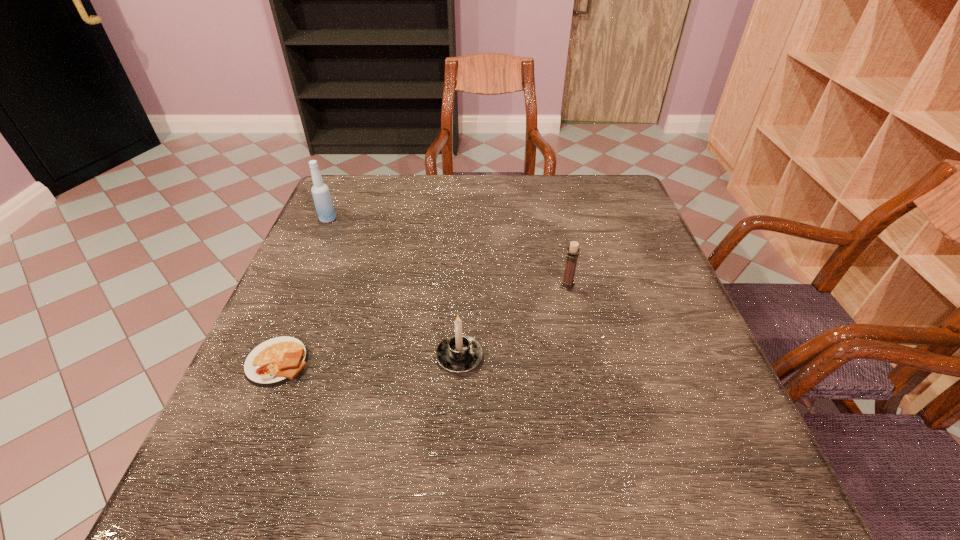
Identify the location of the farthest object. (324, 206).

Locate an element on the screen. This screenshot has width=960, height=540. bottle is located at coordinates (324, 206).

Where is `the second farthest object`? The image size is (960, 540). the second farthest object is located at coordinates (573, 251).

Where is `the rightmost object`? This screenshot has height=540, width=960. the rightmost object is located at coordinates click(x=573, y=251).

Where is `the left candle holder`? The width and height of the screenshot is (960, 540). the left candle holder is located at coordinates (458, 353).

Locate an element on the screen. the nearer candle holder is located at coordinates (458, 353).

Where is `omelet`? Image resolution: width=960 pixels, height=540 pixels. omelet is located at coordinates (275, 361).

Find the location of a particular element. The height and width of the screenshot is (540, 960). free space located on the front of the tallest object is located at coordinates (303, 274).

The width and height of the screenshot is (960, 540). I want to click on blank space located on the front of the rightmost object, so click(592, 402).

Locate an element on the screen. The image size is (960, 540). free spot located 0.070m with a handle on the side of the nearer candle holder is located at coordinates (462, 313).